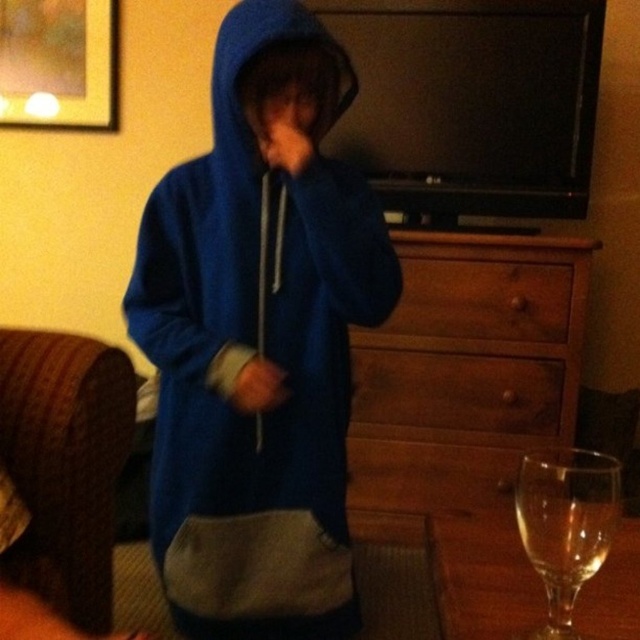
Question: Does wooden dresser at center appear on the left side of transparent glass at lower right?

Choices:
 (A) yes
 (B) no

Answer: (B)

Question: Does wooden dresser at center have a lesser width compared to transparent glass at lower right?

Choices:
 (A) yes
 (B) no

Answer: (B)

Question: Among these points, which one is farthest from the camera?

Choices:
 (A) pos(528,321)
 (B) pos(336,276)
 (C) pos(524,342)

Answer: (C)

Question: Based on their relative distances, which object is farther from the brushed metal picture frame at upper left?

Choices:
 (A) wooden dresser at center
 (B) brown wood drawer at center
 (C) transparent glass at lower right
 (D) blue fleece hoodie at center

Answer: (C)

Question: Which point appears closest to the camera in this image?

Choices:
 (A) (595, 534)
 (B) (545, 288)

Answer: (A)

Question: Is blue fleece hoodie at center behind brushed metal picture frame at upper left?

Choices:
 (A) yes
 (B) no

Answer: (B)